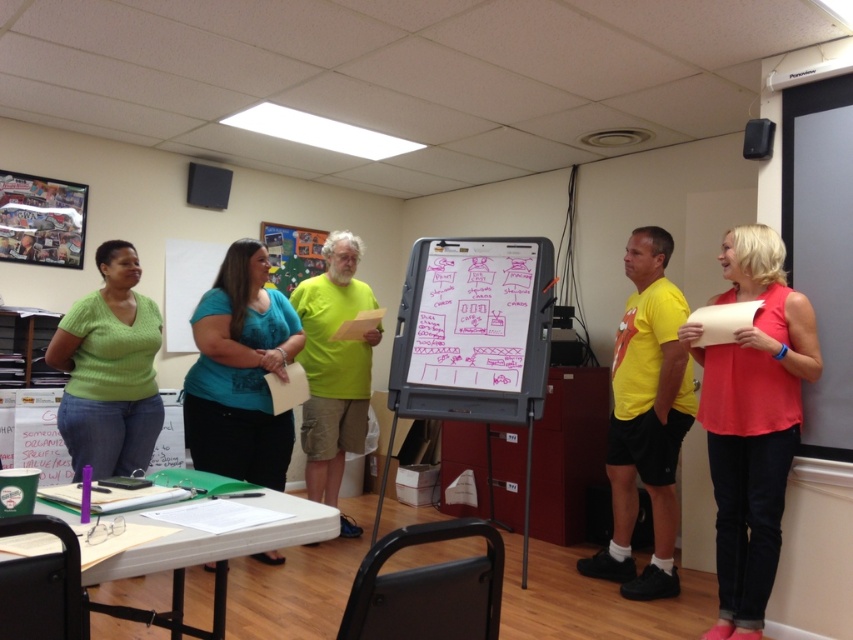
Question: Observing the image, what is the correct spatial positioning of matte coral blouse at right in reference to whiteboard at center?

Choices:
 (A) above
 (B) below

Answer: (B)

Question: Based on their relative distances, which object is farther from the green knitted sweater at center?

Choices:
 (A) matte coral blouse at right
 (B) teal fabric blouse at center

Answer: (A)

Question: Which object appears closest to the camera in this image?

Choices:
 (A) matte coral blouse at right
 (B) teal fabric blouse at center

Answer: (A)

Question: Does matte coral blouse at right appear over green knitted sweater at center?

Choices:
 (A) no
 (B) yes

Answer: (A)

Question: Can you confirm if matte coral blouse at right is positioned to the right of green knitted sweater at center?

Choices:
 (A) yes
 (B) no

Answer: (A)

Question: Based on their relative distances, which object is nearer to the matte coral blouse at right?

Choices:
 (A) whiteboard at center
 (B) green knitted sweater at center

Answer: (A)